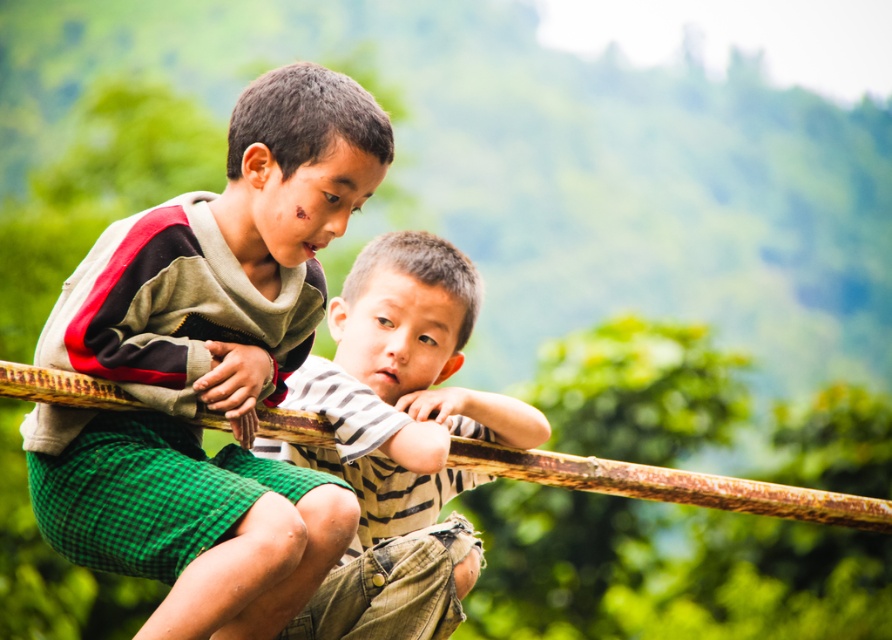
Consider the image. Is green plaid shorts at center further to the viewer compared to striped cotton shirt at center?

No, green plaid shorts at center is in front of striped cotton shirt at center.

Does green plaid shorts at center appear on the right side of striped cotton shirt at center?

In fact, green plaid shorts at center is to the left of striped cotton shirt at center.

I want to click on green plaid shorts at center, so click(x=209, y=369).